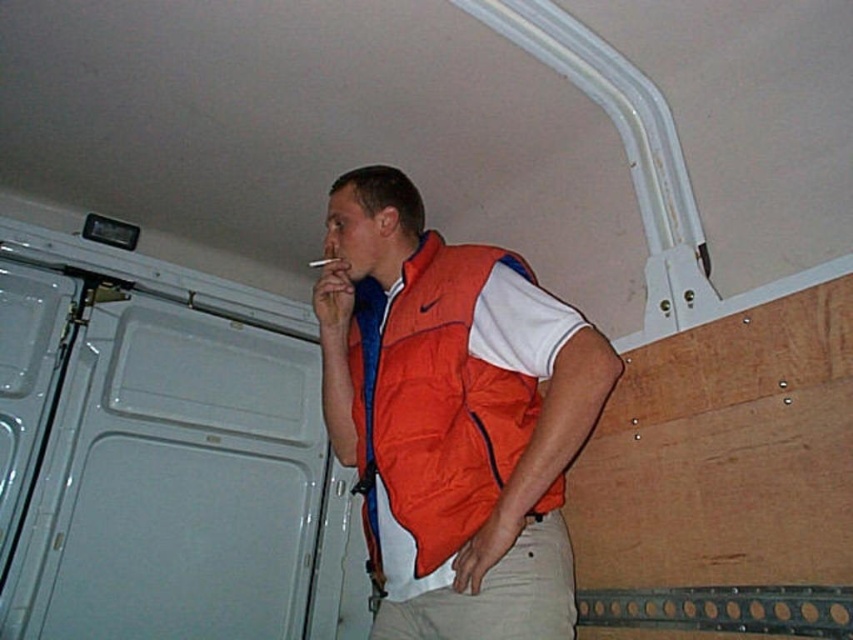
Can you confirm if orange puffer vest at center is positioned above khaki cotton pants at lower center?

Indeed, orange puffer vest at center is positioned over khaki cotton pants at lower center.

Who is positioned more to the right, orange puffer vest at center or khaki cotton pants at lower center?

khaki cotton pants at lower center

Is point (454, 248) positioned behind point (572, 572)?

Yes, it is.

The image size is (853, 640). I want to click on orange puffer vest at center, so click(433, 404).

Who is higher up, orange puffer vest at center or smooth brown cigarette at upper center?

smooth brown cigarette at upper center

Which of these two, orange puffer vest at center or smooth brown cigarette at upper center, stands taller?

orange puffer vest at center

The width and height of the screenshot is (853, 640). Find the location of `orange puffer vest at center`. orange puffer vest at center is located at coordinates (433, 404).

Between khaki cotton pants at lower center and smooth brown cigarette at upper center, which one has more height?

Standing taller between the two is khaki cotton pants at lower center.

Between khaki cotton pants at lower center and smooth brown cigarette at upper center, which one is positioned higher?

smooth brown cigarette at upper center is above.

Is point (544, 605) positioned in front of point (337, 259)?

Yes.

This screenshot has width=853, height=640. What are the coordinates of `khaki cotton pants at lower center` in the screenshot? It's located at (497, 595).